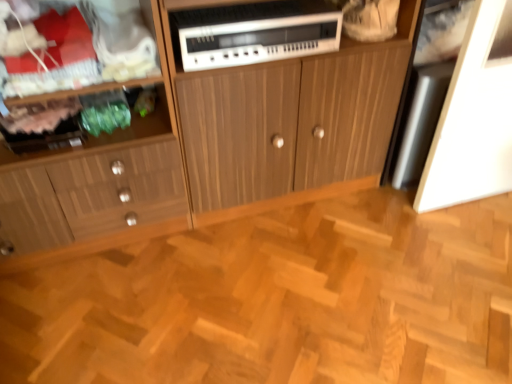
Question: Is natural wood parquet floor at center wider or thinner than white plastic stereo at center?

Choices:
 (A) thin
 (B) wide

Answer: (B)

Question: Considering their positions, is natural wood parquet floor at center located in front of or behind white plastic stereo at center?

Choices:
 (A) front
 (B) behind

Answer: (A)

Question: Which of these objects is positioned closest to the natural wood parquet floor at center?

Choices:
 (A) wooden cabinet at left, which appears as the first cabinetry when viewed from the left
 (B) white plastic stereo at center
 (C) wooden cabinet at center, acting as the 1th cabinetry starting from the right

Answer: (A)

Question: Which object is the farthest from the white plastic stereo at center?

Choices:
 (A) wooden cabinet at left, which appears as the first cabinetry when viewed from the left
 (B) wooden cabinet at center, which appears as the second cabinetry when viewed from the left
 (C) natural wood parquet floor at center

Answer: (C)